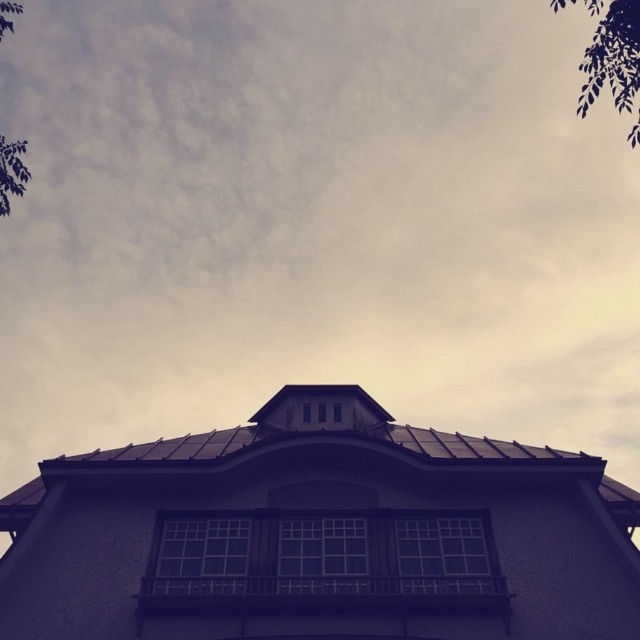
Question: Does metallic gray roof at center appear on the right side of dark green leafy branch at upper right?

Choices:
 (A) yes
 (B) no

Answer: (B)

Question: Which object is farther from the camera taking this photo?

Choices:
 (A) green leafy tree at left
 (B) dark green leafy branch at upper right

Answer: (A)

Question: Estimate the real-world distances between objects in this image. Which object is farther from the green leafy tree at left?

Choices:
 (A) dark green leafy branch at upper right
 (B) metallic gray roof at center

Answer: (A)

Question: Can you confirm if metallic gray roof at center is smaller than green leafy tree at left?

Choices:
 (A) yes
 (B) no

Answer: (A)

Question: Does dark green leafy branch at upper right have a larger size compared to green leafy tree at left?

Choices:
 (A) no
 (B) yes

Answer: (A)

Question: Which object is farther from the camera taking this photo?

Choices:
 (A) dark green leafy branch at upper right
 (B) metallic gray roof at center

Answer: (B)